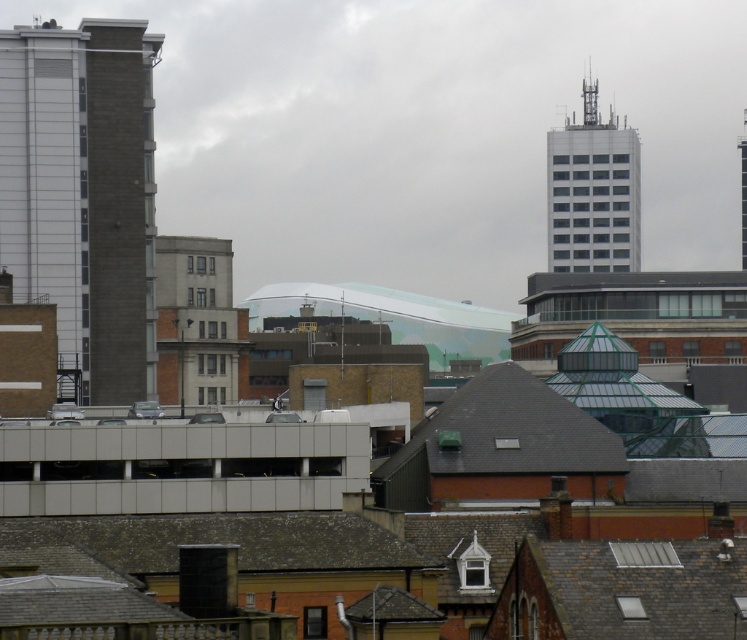
Question: Considering the real-world distances, which object is closest to the white glass building at upper right?

Choices:
 (A) gray slate roof at center
 (B) dark gray concrete building at left
 (C) smooth glass tower at upper right
 (D) brown shingles at lower center

Answer: (C)

Question: Is brown shingles at lower center wider than gray slate roof at center?

Choices:
 (A) no
 (B) yes

Answer: (B)

Question: Observing the image, what is the correct spatial positioning of dark gray concrete building at left in reference to white glass building at upper right?

Choices:
 (A) right
 (B) left

Answer: (B)

Question: Can you confirm if brown shingles at lower center is smaller than smooth glass tower at upper right?

Choices:
 (A) yes
 (B) no

Answer: (A)

Question: Considering the real-world distances, which object is closest to the white glass building at upper right?

Choices:
 (A) brown shingles at lower center
 (B) smooth glass tower at upper right

Answer: (B)

Question: Which of the following is the closest to the observer?

Choices:
 (A) (740, 145)
 (B) (52, 148)
 (C) (548, 436)
 (D) (610, 196)

Answer: (C)